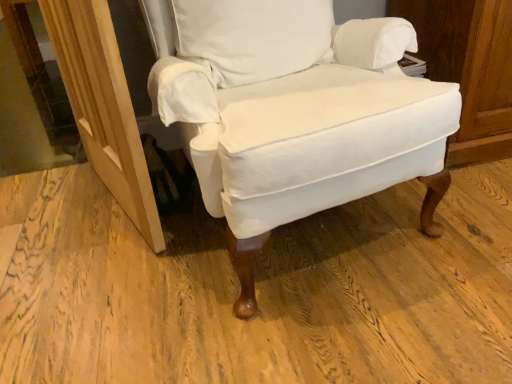
Describe the element at coordinates (103, 106) in the screenshot. I see `wooden screen door at lower left` at that location.

The height and width of the screenshot is (384, 512). Find the location of `white cotton pillow at center`. white cotton pillow at center is located at coordinates (253, 36).

Find the location of a particular element. wooden screen door at lower left is located at coordinates (103, 106).

Would you say white fabric chair at center is outside wooden screen door at lower left?

Indeed, white fabric chair at center is completely outside wooden screen door at lower left.

Is point (226, 31) farther from viewer compared to point (63, 64)?

No, (226, 31) is in front of (63, 64).

Does white fabric chair at center turn towards wooden screen door at lower left?

No, white fabric chair at center is not aimed at wooden screen door at lower left.

From a real-world perspective, is white fabric chair at center positioned over wooden screen door at lower left based on gravity?

Yes, from a real-world perspective, white fabric chair at center is on top of wooden screen door at lower left.

Can you confirm if wooden screen door at lower left is thinner than white cotton pillow at center?

Yes.

Would you say wooden screen door at lower left is inside or outside white cotton pillow at center?

wooden screen door at lower left is outside white cotton pillow at center.

Is wooden screen door at lower left at the right side of white cotton pillow at center?

In fact, wooden screen door at lower left is to the left of white cotton pillow at center.

From a real-world perspective, is wooden screen door at lower left located beneath white cotton pillow at center?

Yes, from a real-world perspective, wooden screen door at lower left is below white cotton pillow at center.

Does white cotton pillow at center have a lesser height compared to wooden screen door at lower left?

Correct, white cotton pillow at center is not as tall as wooden screen door at lower left.

In order to click on screen door located on the left of white cotton pillow at center in this screenshot , I will do `click(103, 106)`.

Is white cotton pillow at center behind wooden screen door at lower left?

Yes, it is.

Is wooden screen door at lower left surrounding white fabric chair at center?

No, white fabric chair at center is not surrounded by wooden screen door at lower left.

Does wooden screen door at lower left have a greater height compared to white fabric chair at center?

No, wooden screen door at lower left is not taller than white fabric chair at center.

Is wooden screen door at lower left facing towards white fabric chair at center?

No, wooden screen door at lower left is not turned towards white fabric chair at center.

Can you see wooden screen door at lower left touching white fabric chair at center?

They are not placed beside each other.

From the image's perspective, is white cotton pillow at center above or below white fabric chair at center?

From the image's perspective, white cotton pillow at center appears above white fabric chair at center.

How far apart are white cotton pillow at center and white fabric chair at center?

The distance of white cotton pillow at center from white fabric chair at center is 5.81 inches.

Is there a large distance between white cotton pillow at center and white fabric chair at center?

No, there isn't a large distance between white cotton pillow at center and white fabric chair at center.

Consider the image. Which object is wider, white cotton pillow at center or white fabric chair at center?

With larger width is white fabric chair at center.

At what (x,y) coordinates should I click in order to perform the action: click on pillow above the white fabric chair at center (from the image's perspective). Please return your answer as a coordinate pair (x, y). The image size is (512, 384). Looking at the image, I should click on (253, 36).

Considering their positions, is white fabric chair at center located in front of or behind white cotton pillow at center?

Visually, white fabric chair at center is located in front of white cotton pillow at center.

Considering the sizes of white fabric chair at center and white cotton pillow at center in the image, is white fabric chair at center taller or shorter than white cotton pillow at center?

Considering their sizes, white fabric chair at center has more height than white cotton pillow at center.

What's the angular difference between white fabric chair at center and white cotton pillow at center's facing directions?

The facing directions of white fabric chair at center and white cotton pillow at center are 1.89 degrees apart.

In order to click on screen door below the white fabric chair at center (from the image's perspective) in this screenshot , I will do `click(103, 106)`.

Locate an element on the screen. screen door on the left of white cotton pillow at center is located at coordinates (103, 106).

Considering their positions, is white fabric chair at center positioned closer to white cotton pillow at center than wooden screen door at lower left?

white fabric chair at center lies closer to white cotton pillow at center than the other object.

From the picture: Which object lies further to the anchor point white cotton pillow at center, wooden screen door at lower left or white fabric chair at center?

wooden screen door at lower left.

When comparing their distances from wooden screen door at lower left, does white cotton pillow at center or white fabric chair at center seem further?

Among the two, white cotton pillow at center is located further to wooden screen door at lower left.

Which object lies nearer to the anchor point white fabric chair at center, white cotton pillow at center or wooden screen door at lower left?

Among the two, white cotton pillow at center is located nearer to white fabric chair at center.

Estimate the real-world distances between objects in this image. Which object is closer to wooden screen door at lower left, white fabric chair at center or white cotton pillow at center?

white fabric chair at center is closer to wooden screen door at lower left.

When comparing their distances from white fabric chair at center, does wooden screen door at lower left or white cotton pillow at center seem closer?

white cotton pillow at center is closer to white fabric chair at center.

Locate an element on the screen. The height and width of the screenshot is (384, 512). pillow situated between wooden screen door at lower left and white fabric chair at center from left to right is located at coordinates (253, 36).